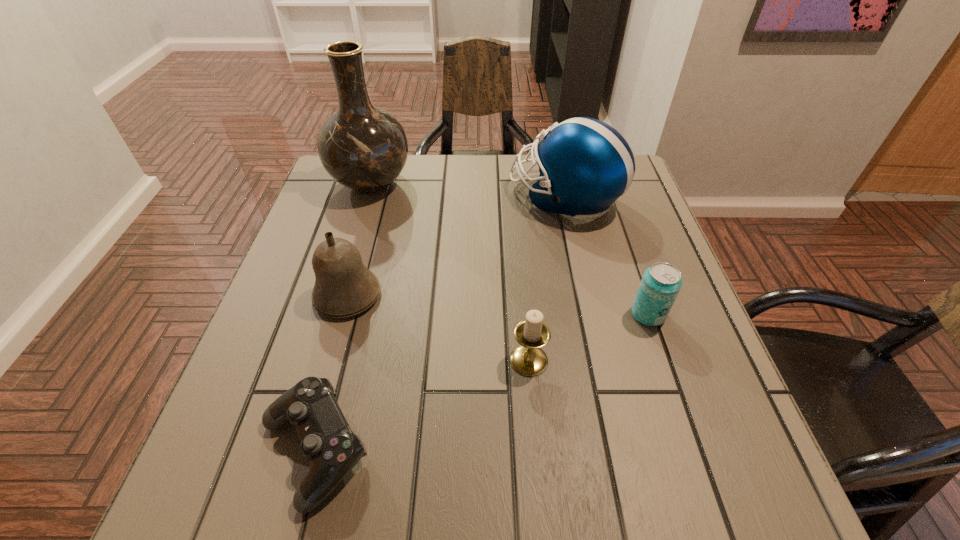
Identify the location of vacant space at the near right corner. The image size is (960, 540). (729, 468).

Find the location of a particular element. free area in between the fourth shortest object and the shortest object is located at coordinates (331, 373).

Identify the location of unoccupied area between the beer can and the nearest object. (482, 382).

This screenshot has height=540, width=960. Find the location of `free space between the third tallest object and the shortest object`. free space between the third tallest object and the shortest object is located at coordinates (331, 373).

I want to click on free space between the fifth farthest object and the third tallest object, so click(x=438, y=328).

Find the location of a particular element. Image resolution: width=960 pixels, height=540 pixels. unoccupied area between the beer can and the bell is located at coordinates (498, 305).

Find the location of a particular element. The height and width of the screenshot is (540, 960). free space that is in between the vase and the beer can is located at coordinates (510, 249).

Image resolution: width=960 pixels, height=540 pixels. Find the location of `vacant space that is in between the tallest object and the second tallest object`. vacant space that is in between the tallest object and the second tallest object is located at coordinates (468, 191).

You are a GUI agent. You are given a task and a screenshot of the screen. Output one action in this format:
    pyautogui.click(x=<x>, y=<y>)
    Task: Click on the empty space between the second nearest object and the vase
    
    Given the screenshot: What is the action you would take?
    click(450, 272)

In order to click on the third closest object to the second nearest object in this screenshot , I will do `click(344, 287)`.